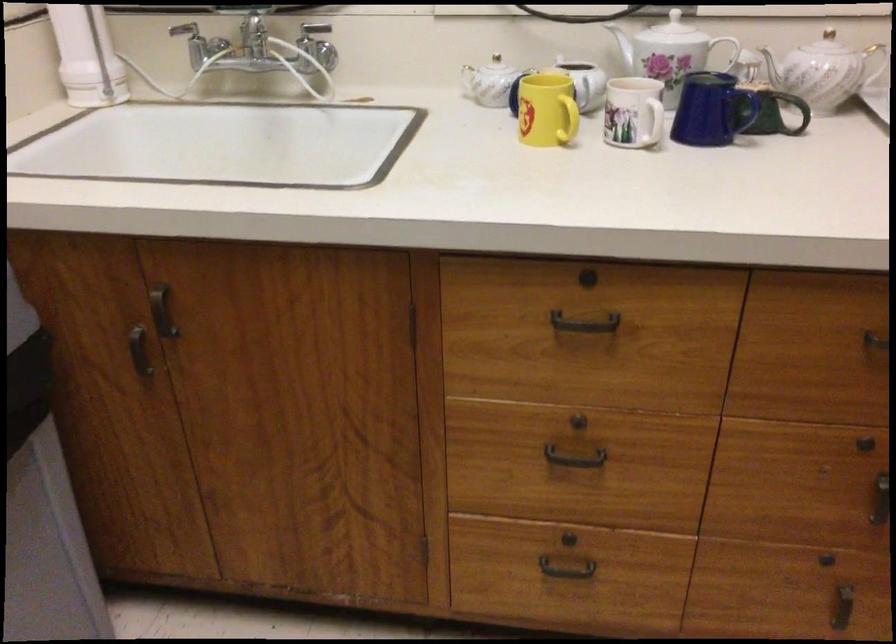
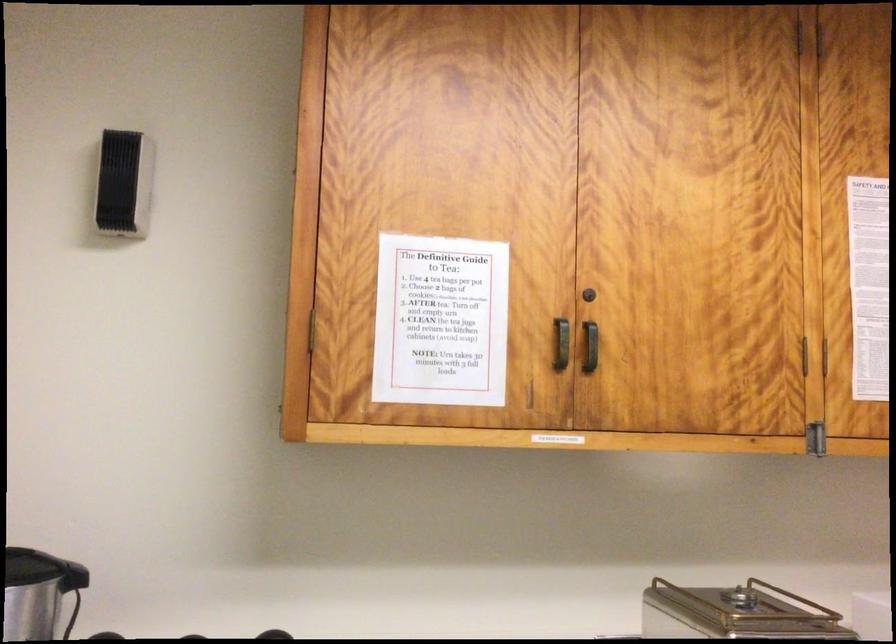
Question: The camera is either moving clockwise (left) or counter-clockwise (right) around the object. The first image is from the beginning of the video and the second image is from the end. Is the camera moving left or right when shooting the video?

Choices:
 (A) Left
 (B) Right

Answer: (A)